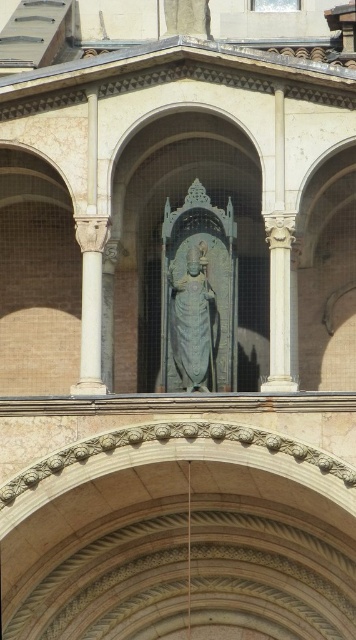
Question: Is gray stone statue at center positioned behind white marble column at right?

Choices:
 (A) no
 (B) yes

Answer: (B)

Question: Does gray stone statue at center appear on the right side of white marble column at right?

Choices:
 (A) no
 (B) yes

Answer: (A)

Question: Can you confirm if gray stone statue at center is positioned below white marble column at right?

Choices:
 (A) no
 (B) yes

Answer: (B)

Question: Which object appears closest to the camera in this image?

Choices:
 (A) white marble column at right
 (B) gray stone statue at center

Answer: (A)